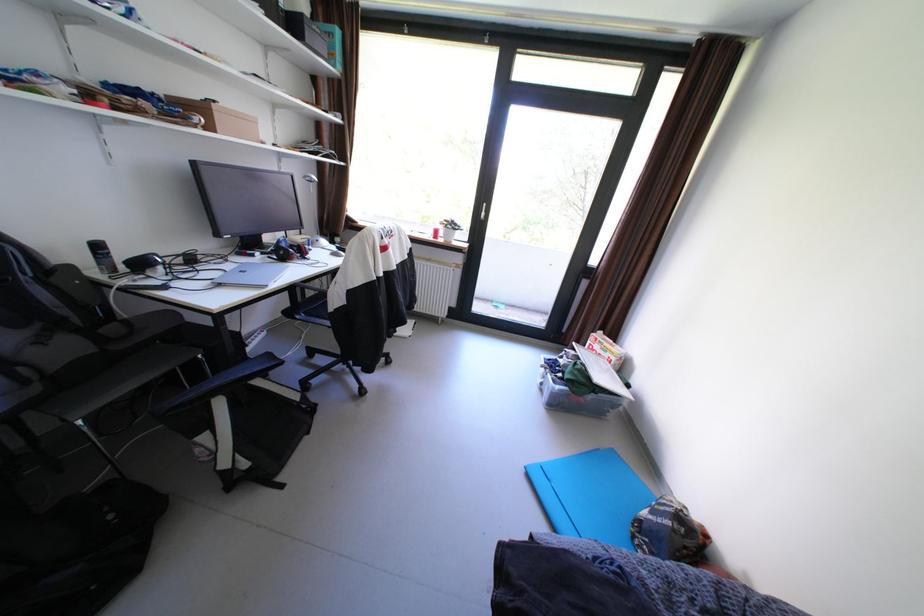
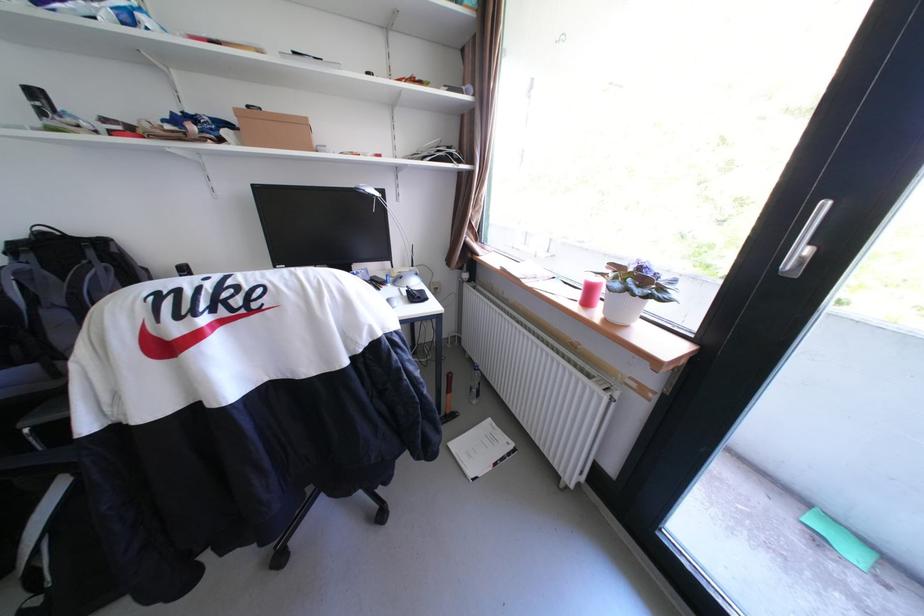
The point at [347,246] is marked in the first image. Where is the corresponding point in the second image?

(418, 291)